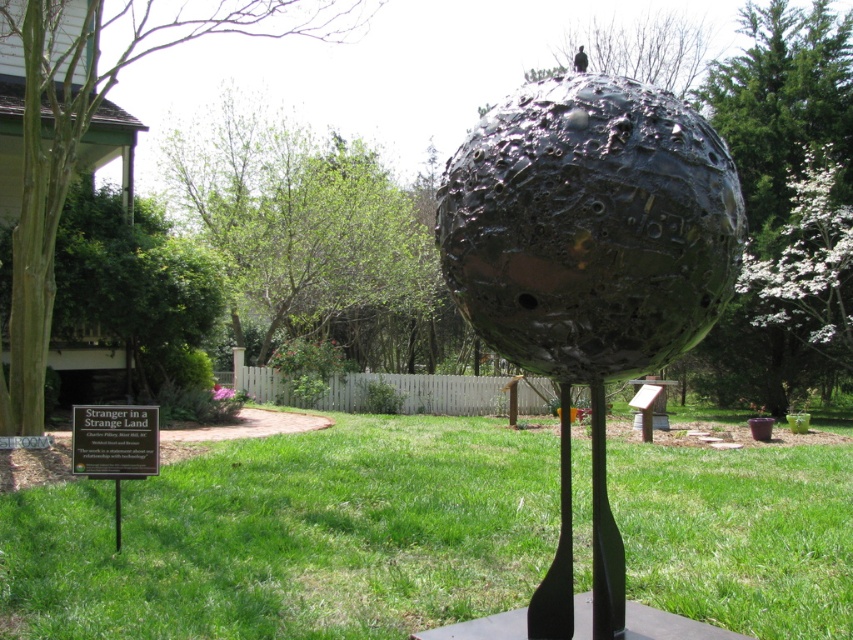
Is point (531, 512) positioned in front of point (633, 301)?

That is False.

Does green grass at center have a greater width compared to shiny metallic sphere at center?

Incorrect, green grass at center's width does not surpass shiny metallic sphere at center's.

Is point (834, 616) positioned after point (599, 336)?

Yes, it is behind point (599, 336).

Where is `green grass at center`? Image resolution: width=853 pixels, height=640 pixels. green grass at center is located at coordinates (292, 536).